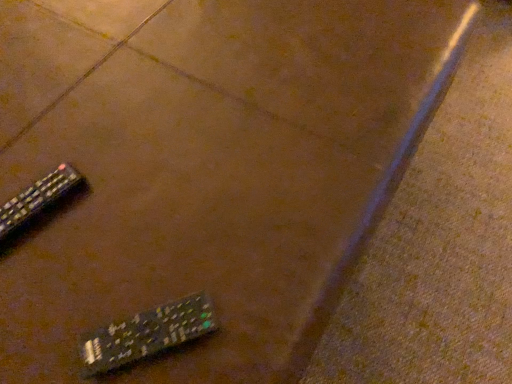
The width and height of the screenshot is (512, 384). I want to click on vacant area that is situated to the right of black plastic remote at lower left, the 1th remote control positioned from the top, so click(145, 213).